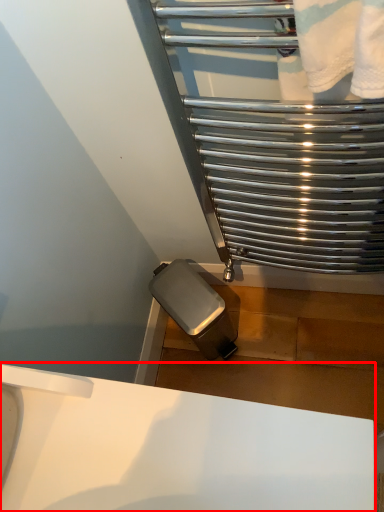
Question: Where is sink (annotated by the red box) located in relation to glass door in the image?

Choices:
 (A) right
 (B) left

Answer: (B)